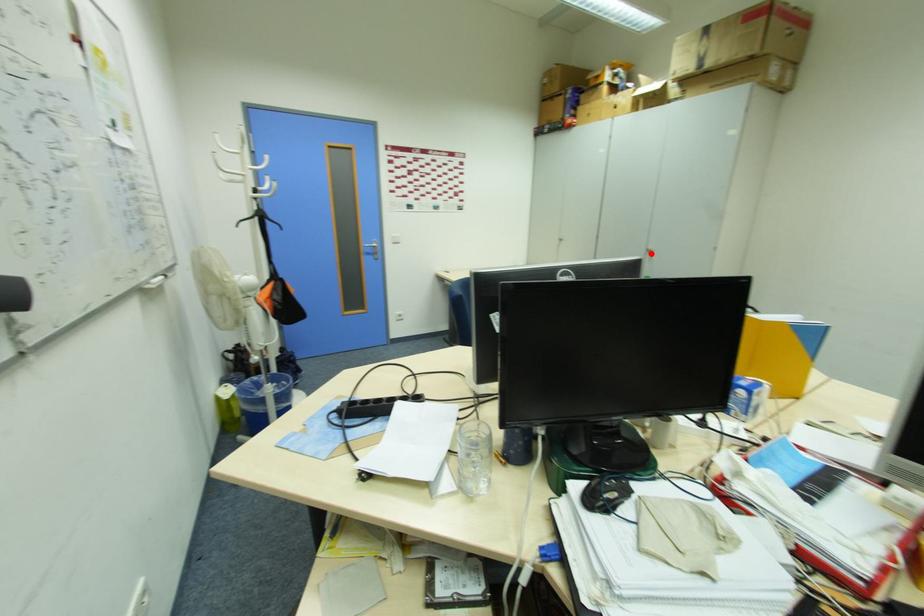
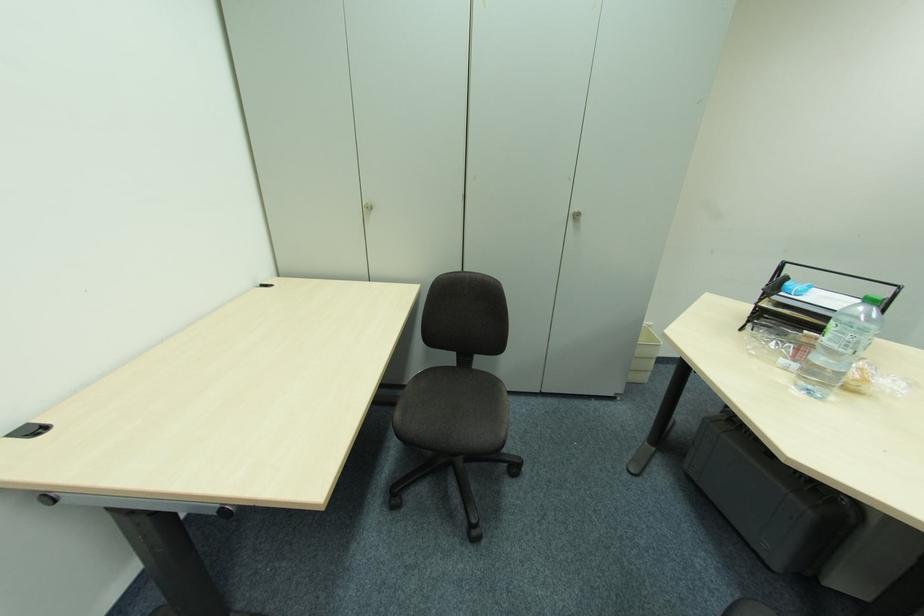
Question: A red point is marked in image1. In image2, is the corresponding 3D point closer to the camera or farther? Reply with the corresponding letter.

Choices:
 (A) The corresponding 3D point is closer.
 (B) The corresponding 3D point is farther.

Answer: (A)